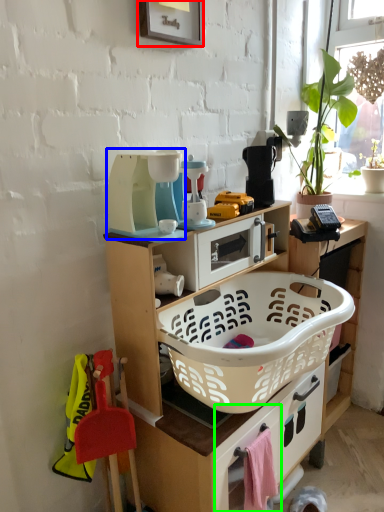
Question: Which object is the closest to the picture frame (highlighted by a red box)? Choose among these: appliance (highlighted by a blue box) or drawer (highlighted by a green box).

Choices:
 (A) appliance
 (B) drawer

Answer: (A)